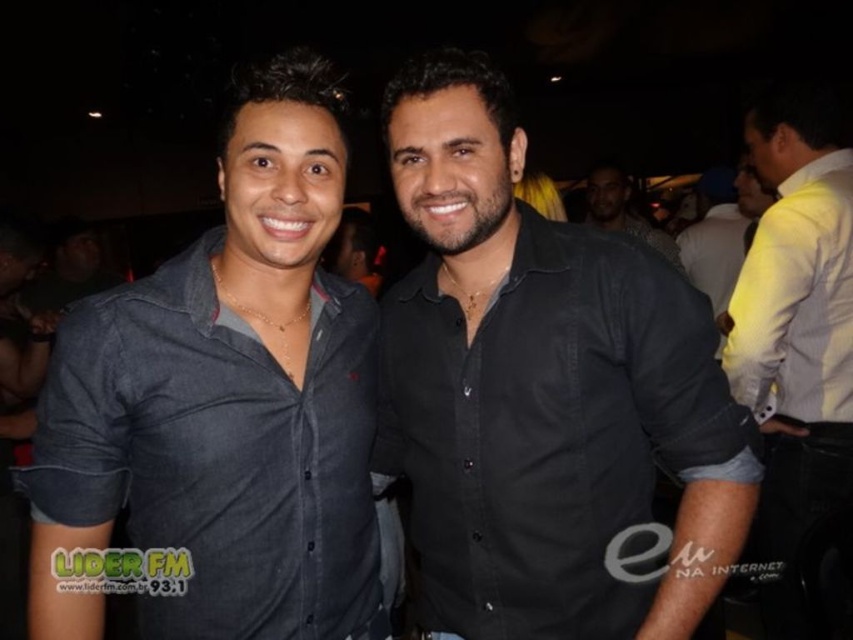
Which is more to the left, denim shirt at center or yellow cotton shirt at right?

denim shirt at center

Who is more forward, (44, 621) or (769, 321)?

Point (44, 621) is in front.

Where is `denim shirt at center`? denim shirt at center is located at coordinates click(x=225, y=403).

Does yellow cotton shirt at right appear on the right side of black matte shirt at center?

Indeed, yellow cotton shirt at right is positioned on the right side of black matte shirt at center.

You are a GUI agent. You are given a task and a screenshot of the screen. Output one action in this format:
    pyautogui.click(x=<x>, y=<y>)
    Task: Click on the yellow cotton shirt at right
    
    Given the screenshot: What is the action you would take?
    pyautogui.click(x=795, y=328)

Is point (793, 294) closer to camera compared to point (622, 212)?

Yes, point (793, 294) is closer to viewer.

Image resolution: width=853 pixels, height=640 pixels. In order to click on yellow cotton shirt at right in this screenshot , I will do click(795, 328).

What do you see at coordinates (543, 392) in the screenshot? The height and width of the screenshot is (640, 853). I see `black cotton shirt at center` at bounding box center [543, 392].

You are a GUI agent. You are given a task and a screenshot of the screen. Output one action in this format:
    pyautogui.click(x=<x>, y=<y>)
    Task: Click on the black cotton shirt at center
    
    Given the screenshot: What is the action you would take?
    pyautogui.click(x=543, y=392)